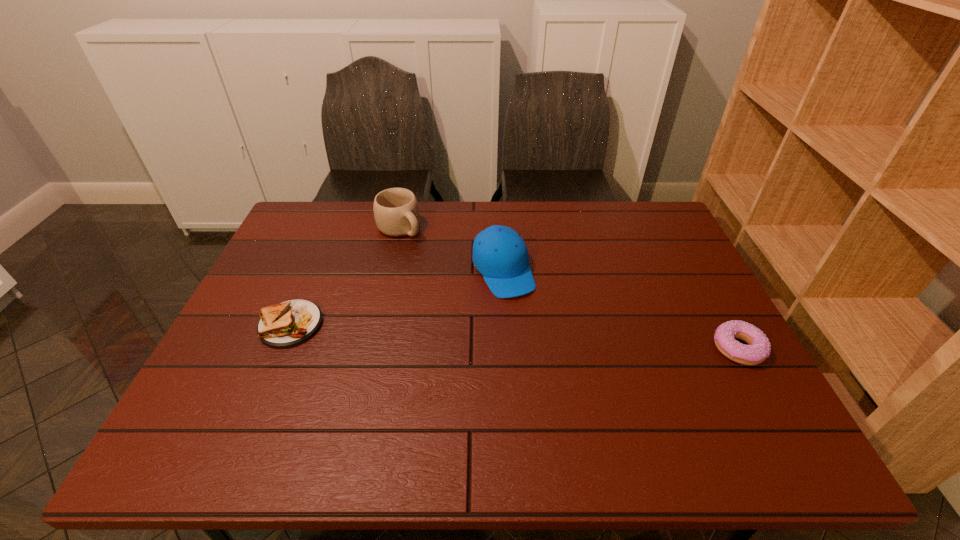
Where is `free spot located on the side of the mug with the handle`? Image resolution: width=960 pixels, height=540 pixels. free spot located on the side of the mug with the handle is located at coordinates (457, 276).

Where is `vacant space located on the front-facing side of the third nearest object`? vacant space located on the front-facing side of the third nearest object is located at coordinates (538, 338).

The height and width of the screenshot is (540, 960). In order to click on free region located 0.360m on the front-facing side of the third nearest object in this screenshot , I will do `click(577, 409)`.

What are the coordinates of `vacant area situated 0.050m on the front-facing side of the third nearest object` in the screenshot? It's located at (522, 310).

Locate an element on the screen. This screenshot has width=960, height=540. object at the far edge is located at coordinates (396, 212).

Identify the location of object that is positioned at the left edge. The width and height of the screenshot is (960, 540). (289, 323).

Identify the location of object located at the right edge. The image size is (960, 540). (759, 348).

The image size is (960, 540). In the image, there is a desktop. In order to click on blank space at the far edge in this screenshot , I will do `click(430, 207)`.

This screenshot has width=960, height=540. I want to click on free space at the near edge of the desktop, so click(x=689, y=409).

In the image, there is a desktop. Where is `free region at the left edge`? Image resolution: width=960 pixels, height=540 pixels. free region at the left edge is located at coordinates (284, 294).